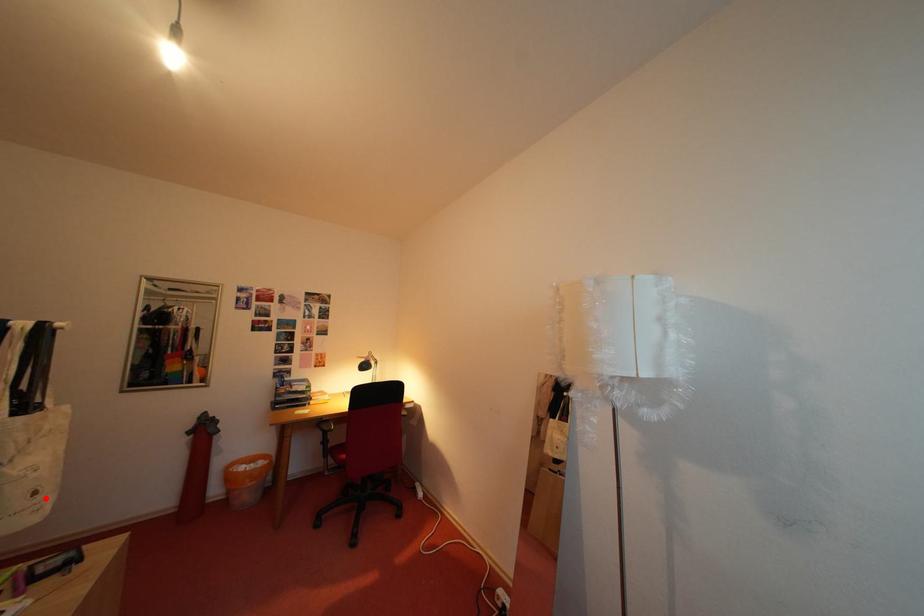
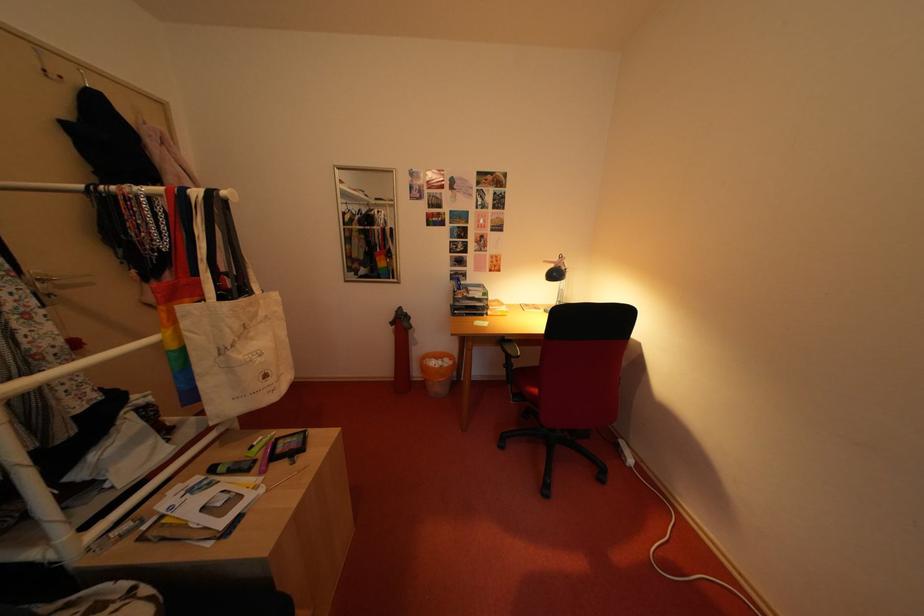
Question: I am providing you with two images of the same scene from different viewpoints. In image1, a red point is highlighted. Considering the same 3D point in image2, which of the following is correct?

Choices:
 (A) It is closer
 (B) It is farther

Answer: (B)